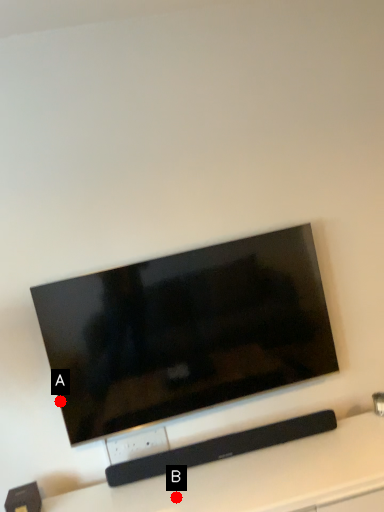
Question: Two points are circled on the image, labeled by A and B beside each circle. Which point is farther to the camera?

Choices:
 (A) A is further
 (B) B is further

Answer: (A)